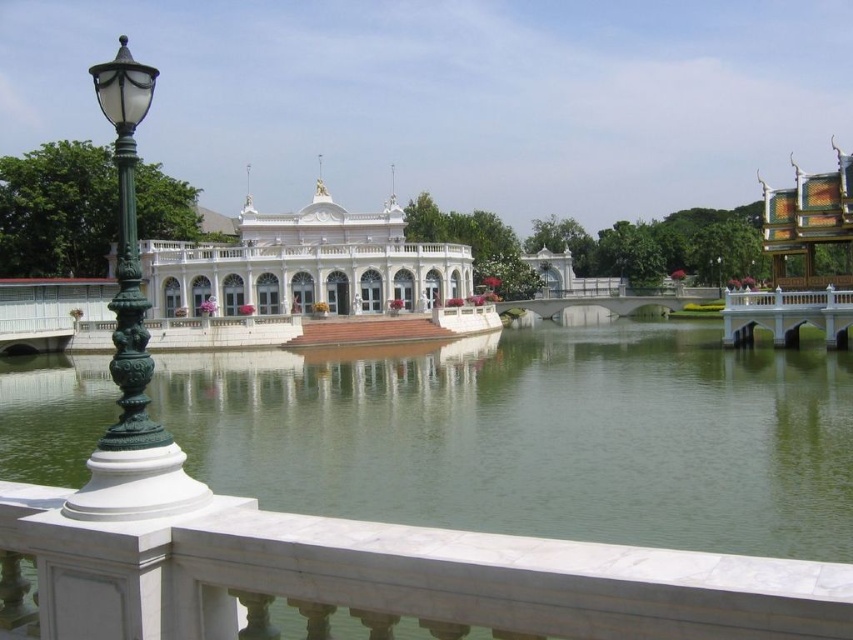
You are standing on the walkway in front of the building and want to take a photo of the green ornate metal lamp post at left and the green water at center. Which object should you focus on first if you want both to be in sharp focus?

The green ornate metal lamp post at left is behind green water at center, so you should focus on the lamp post first to ensure both are in focus since it is farther away.

You are standing on the walkway in front of the white marble palace at center and the green ornate metal lamp post at left. Which object is taller?

The green ornate metal lamp post at left is taller than the white marble palace at center.